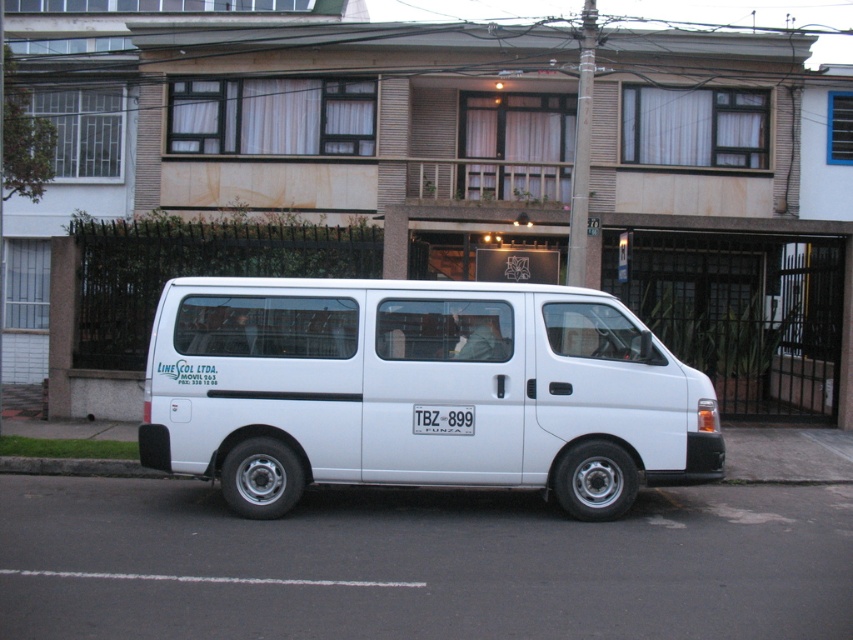
You are a delivery driver trying to park your white matte van at center in a parking spot that is exactly the same width as your van. There is a white plastic license plate at center already in the spot. Can your van fit without overlapping the license plate?

The white matte van at center is wider than the white plastic license plate at center, so if the parking spot is exactly the same width as the van, the license plate would be outside the spot, and the van can fit without overlapping it.

You are standing on the sidewalk in front of the residential building. You notice a point marked at coordinate (416, 392) in the image. What object is located at that point?

The point at coordinate (416, 392) corresponds to the white matte van at center.